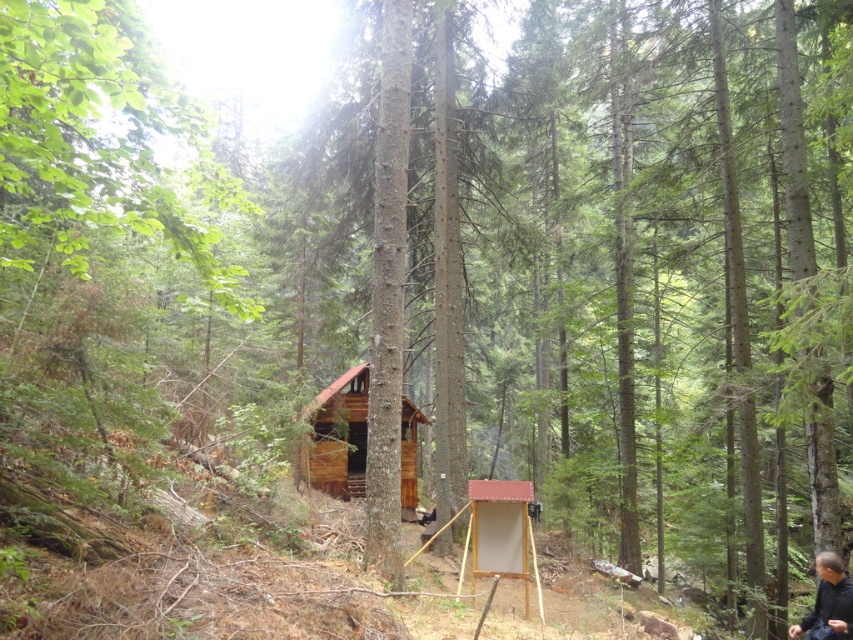
You are an archer preparing to shoot an arrow. You have a white cardboard at center and a dark brown leather jacket at lower right in your view. Which object is shorter?

The white cardboard at center is not as tall as the dark brown leather jacket at lower right, so the white cardboard at center is shorter.